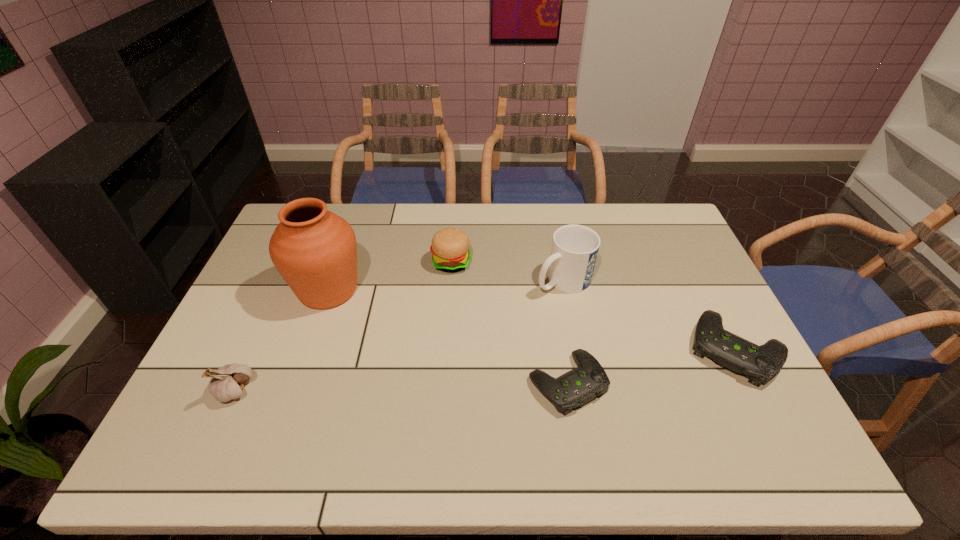
Please point a spot to add another control on the left. Please provide its 2D coordinates. Your answer should be formatted as a tuple, i.e. [(x, y)], where the tuple contains the x and y coordinates of a point satisfying the conditions above.

[(375, 421)]